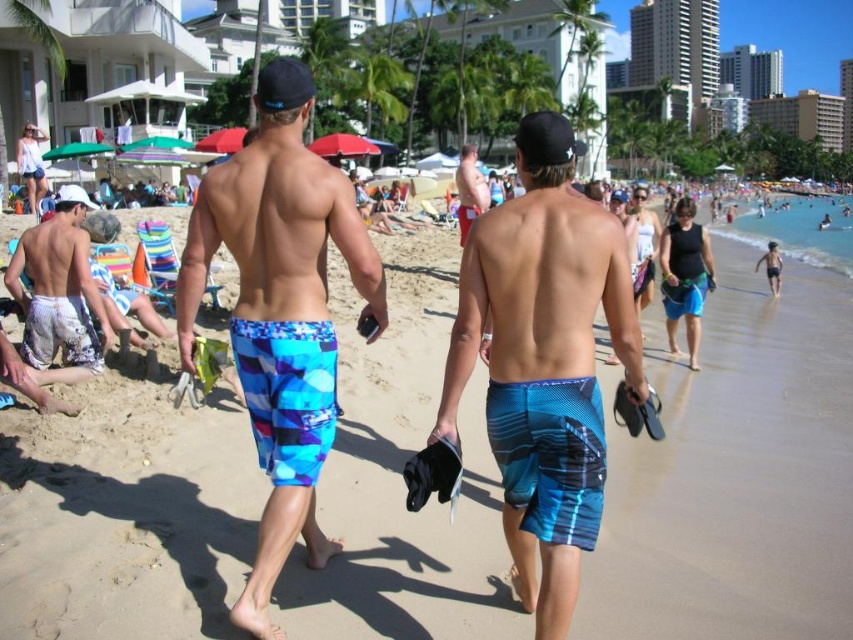
Question: Can you confirm if blue textured boardshorts at center is thinner than blue printed boardshorts at center?

Choices:
 (A) yes
 (B) no

Answer: (A)

Question: Which point appears farthest from the camera in this image?

Choices:
 (A) [x=270, y=244]
 (B) [x=575, y=506]
 (C) [x=68, y=253]

Answer: (C)

Question: Estimate the real-world distances between objects in this image. Which object is closer to the blue plaid shorts at center?

Choices:
 (A) white matte shorts at left
 (B) blue textured boardshorts at center
 (C) blue printed boardshorts at center
 (D) blue checkered boardshorts at center

Answer: (C)

Question: Can you confirm if blue textured boardshorts at center is smaller than white matte shorts at left?

Choices:
 (A) yes
 (B) no

Answer: (B)

Question: Observing the image, what is the correct spatial positioning of blue textured boardshorts at center in reference to white matte shorts at left?

Choices:
 (A) above
 (B) below

Answer: (B)

Question: Among these points, which one is nearest to the camera?

Choices:
 (A) (347, 228)
 (B) (469, 216)
 (C) (51, 289)
 (D) (24, 524)

Answer: (A)